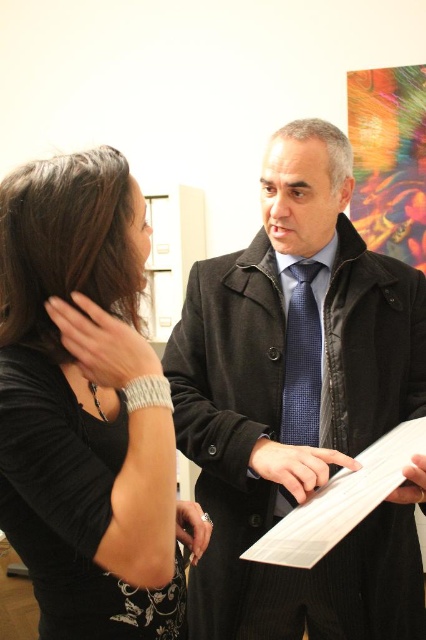
Is black matte shirt at left to the left of blue textured tie at center from the viewer's perspective?

Yes, black matte shirt at left is to the left of blue textured tie at center.

Who is positioned more to the right, black matte shirt at left or blue textured tie at center?

blue textured tie at center

Where is `black matte shirt at left`? black matte shirt at left is located at coordinates (86, 406).

You are a GUI agent. You are given a task and a screenshot of the screen. Output one action in this format:
    pyautogui.click(x=<x>, y=<y>)
    Task: Click on the black matte shirt at left
    The image size is (426, 640).
    Given the screenshot: What is the action you would take?
    pyautogui.click(x=86, y=406)

Is black leather coat at center thinner than black matte shirt at left?

No, black leather coat at center is not thinner than black matte shirt at left.

Can you confirm if black leather coat at center is taller than black matte shirt at left?

Yes.

The width and height of the screenshot is (426, 640). Describe the element at coordinates (299, 404) in the screenshot. I see `black leather coat at center` at that location.

Find the location of a particular element. The image size is (426, 640). black leather coat at center is located at coordinates (299, 404).

Does point (302, 481) lie behind point (305, 324)?

No, it is in front of (305, 324).

Between point (250, 520) and point (302, 276), which one is positioned in front?

Point (250, 520) is more forward.

Does point (328, 182) come in front of point (299, 310)?

Yes, it is.

Image resolution: width=426 pixels, height=640 pixels. Identify the location of black leather coat at center. (299, 404).